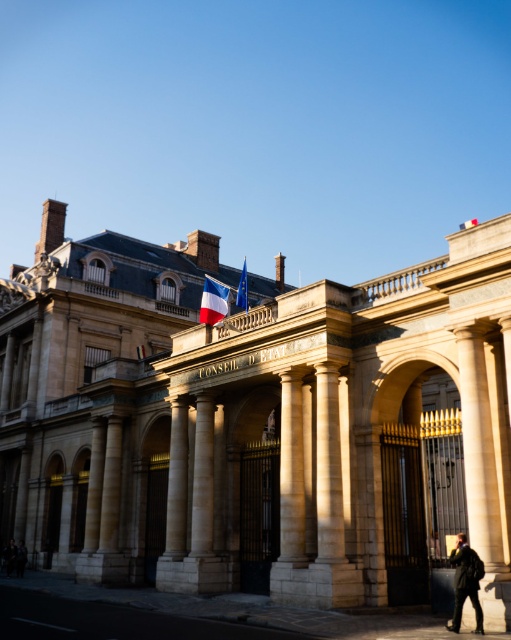
You are standing in front of the building and want to take a photo of the stone building at center. Where should you position yourself to capture the entire building in the frame?

The stone building at center is located at point (259, 420), so you should position yourself directly in front of it to capture the entire structure within the frame.